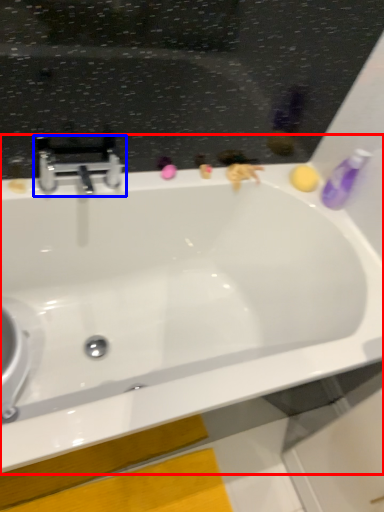
Question: Which object appears farthest to the camera in this image, bathtub (highlighted by a red box) or tap (highlighted by a blue box)?

Choices:
 (A) bathtub
 (B) tap

Answer: (B)